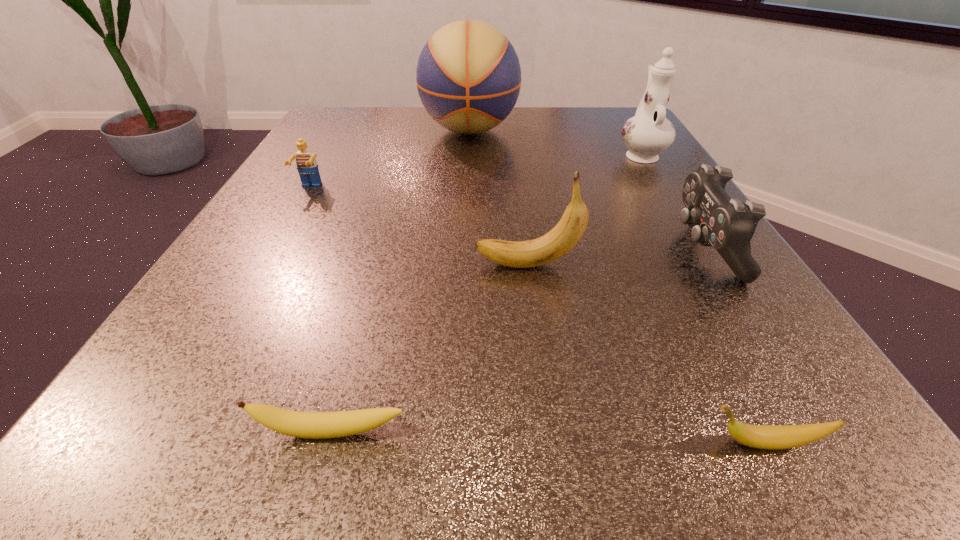
Image resolution: width=960 pixels, height=540 pixels. Identify the location of free spot between the fourth shortest object and the chinaware. (672, 201).

Identify the location of vacant area that lies between the leftmost banana and the control. (517, 340).

Locate an element on the screen. This screenshot has height=540, width=960. free space between the basketball and the fourth tallest object is located at coordinates (587, 189).

Where is `free space between the Lego and the control`? The height and width of the screenshot is (540, 960). free space between the Lego and the control is located at coordinates (507, 218).

I want to click on free point between the leftmost banana and the basketball, so click(400, 281).

This screenshot has height=540, width=960. Find the location of `free space between the basketball and the second banana from left to right`. free space between the basketball and the second banana from left to right is located at coordinates (498, 198).

Locate an element on the screen. free space between the rightmost banana and the farthest banana is located at coordinates [646, 354].

The width and height of the screenshot is (960, 540). I want to click on the fifth closest object relative to the tallest banana, so click(x=307, y=166).

What are the coordinates of `the second closest object to the fifth nearest object` in the screenshot? It's located at (564, 236).

Identify the location of banana that is the closest to the basketball. The image size is (960, 540). (564, 236).